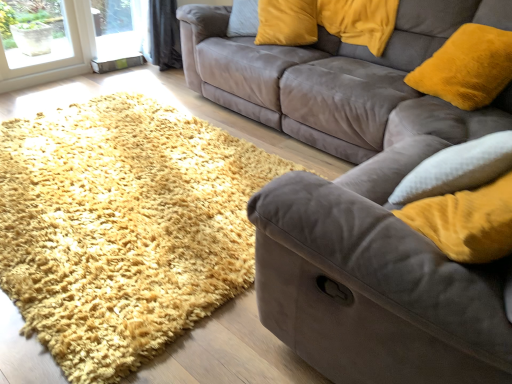
This screenshot has height=384, width=512. Describe the element at coordinates (359, 21) in the screenshot. I see `velvet yellow pillow at upper right, arranged as the 2th pillow when viewed from the left` at that location.

This screenshot has height=384, width=512. In order to click on velvet yellow pillow at upper center, which appears as the second pillow when viewed from the right in this screenshot , I will do `click(287, 22)`.

Describe the element at coordinates (323, 72) in the screenshot. I see `velvet gray couch at center, which appears as the 1th studio couch when viewed from the back` at that location.

The width and height of the screenshot is (512, 384). In order to click on suede couch at center, the second studio couch positioned from the back in this screenshot , I will do `click(361, 199)`.

Is suede couch at center, the 1th studio couch from the front, touching velvet gray couch at center, which ranks as the second studio couch in front-to-back order?

No, suede couch at center, the 1th studio couch from the front, is not in contact with velvet gray couch at center, which ranks as the second studio couch in front-to-back order.

From a real-world perspective, who is located lower, suede couch at center, the second studio couch positioned from the back, or velvet gray couch at center, which ranks as the second studio couch in front-to-back order?

velvet gray couch at center, which ranks as the second studio couch in front-to-back order, is physically lower.

Is point (240, 40) more distant than point (301, 112)?

Yes, point (240, 40) is farther from viewer.

Would you consider velvet yellow pillow at upper center, which appears as the second pillow when viewed from the right, to be distant from velvet yellow pillow at upper right, arranged as the 2th pillow when viewed from the left?

They are positioned close to each other.

Relative to velvet yellow pillow at upper right, which appears as the first pillow when viewed from the right, is velvet yellow pillow at upper center, which is counted as the first pillow, starting from the left, in front or behind?

velvet yellow pillow at upper center, which is counted as the first pillow, starting from the left, is positioned farther from the viewer than velvet yellow pillow at upper right, which appears as the first pillow when viewed from the right.

Is velvet yellow pillow at upper center, which is counted as the first pillow, starting from the left, situated inside velvet yellow pillow at upper right, arranged as the 2th pillow when viewed from the left, or outside?

velvet yellow pillow at upper center, which is counted as the first pillow, starting from the left, cannot be found inside velvet yellow pillow at upper right, arranged as the 2th pillow when viewed from the left.

In terms of width, does velvet yellow pillow at upper center, which is counted as the first pillow, starting from the left, look wider or thinner when compared to velvet yellow pillow at upper right, which appears as the first pillow when viewed from the right?

velvet yellow pillow at upper center, which is counted as the first pillow, starting from the left, is thinner than velvet yellow pillow at upper right, which appears as the first pillow when viewed from the right.

Is suede couch at center, the 1th studio couch from the front, at the right side of velvet yellow pillow at upper right, arranged as the 2th pillow when viewed from the left?

Correct, you'll find suede couch at center, the 1th studio couch from the front, to the right of velvet yellow pillow at upper right, arranged as the 2th pillow when viewed from the left.

From the image's perspective, which is above, suede couch at center, the 1th studio couch from the front, or velvet yellow pillow at upper right, which appears as the first pillow when viewed from the right?

velvet yellow pillow at upper right, which appears as the first pillow when viewed from the right, is shown above in the image.

Based on the photo, is velvet yellow pillow at upper right, arranged as the 2th pillow when viewed from the left, completely or partially inside suede couch at center, the 1th studio couch from the front?

No, velvet yellow pillow at upper right, arranged as the 2th pillow when viewed from the left, is not inside suede couch at center, the 1th studio couch from the front.

This screenshot has width=512, height=384. What are the coordinates of `studio couch to the right of velvet yellow pillow at upper right, which appears as the first pillow when viewed from the right` in the screenshot? It's located at tap(361, 199).

Is point (183, 61) farther from camera compared to point (295, 42)?

Yes, point (183, 61) is farther from viewer.

Identify the location of pillow on the left of velvet gray couch at center, which appears as the 1th studio couch when viewed from the back. point(287,22).

From their relative heights in the image, would you say velvet gray couch at center, which appears as the 1th studio couch when viewed from the back, is taller or shorter than velvet yellow pillow at upper center, which is counted as the first pillow, starting from the left?

Considering their sizes, velvet gray couch at center, which appears as the 1th studio couch when viewed from the back, has more height than velvet yellow pillow at upper center, which is counted as the first pillow, starting from the left.

From the picture: Is shaggy yellow rug at lower left at the back of velvet gray couch at center, which appears as the 1th studio couch when viewed from the back?

No, velvet gray couch at center, which appears as the 1th studio couch when viewed from the back,'s orientation is not away from shaggy yellow rug at lower left.

From the image's perspective, is velvet gray couch at center, which appears as the 1th studio couch when viewed from the back, located above or below shaggy yellow rug at lower left?

velvet gray couch at center, which appears as the 1th studio couch when viewed from the back, is situated higher than shaggy yellow rug at lower left in the image.

How different are the orientations of velvet gray couch at center, which ranks as the second studio couch in front-to-back order, and shaggy yellow rug at lower left in degrees?

They differ by 2.64e-05 degrees in their facing directions.

Measure the distance between velvet gray couch at center, which appears as the 1th studio couch when viewed from the back, and shaggy yellow rug at lower left.

A distance of 33.49 inches exists between velvet gray couch at center, which appears as the 1th studio couch when viewed from the back, and shaggy yellow rug at lower left.

Does point (263, 64) lie in front of point (373, 103)?

No, (263, 64) is behind (373, 103).

Is velvet gray couch at center, which appears as the 1th studio couch when viewed from the back, positioned in front of suede couch at center, the second studio couch positioned from the back?

That is False.

Can you tell me how much velvet yellow pillow at upper center, which is counted as the first pillow, starting from the left, and shaggy yellow rug at lower left differ in facing direction?

There is a 36.6-degree angle between the facing directions of velvet yellow pillow at upper center, which is counted as the first pillow, starting from the left, and shaggy yellow rug at lower left.

Considering the points (311, 42) and (90, 213), which point is behind, point (311, 42) or point (90, 213)?

Point (311, 42)

Is velvet yellow pillow at upper center, which is counted as the first pillow, starting from the left, to the right of shaggy yellow rug at lower left from the viewer's perspective?

Indeed, velvet yellow pillow at upper center, which is counted as the first pillow, starting from the left, is positioned on the right side of shaggy yellow rug at lower left.

Considering the relative sizes of velvet yellow pillow at upper center, which appears as the second pillow when viewed from the right, and shaggy yellow rug at lower left in the image provided, is velvet yellow pillow at upper center, which appears as the second pillow when viewed from the right, thinner than shaggy yellow rug at lower left?

Yes.

Where is `studio couch in front of the velvet gray couch at center, which ranks as the second studio couch in front-to-back order`? Image resolution: width=512 pixels, height=384 pixels. studio couch in front of the velvet gray couch at center, which ranks as the second studio couch in front-to-back order is located at coordinates (361, 199).

Identify the location of pillow behind the velvet yellow pillow at upper right, arranged as the 2th pillow when viewed from the left. (287, 22).

Looking at the image, which one is located closer to shaggy yellow rug at lower left, velvet yellow pillow at upper center, which appears as the second pillow when viewed from the right, or velvet yellow pillow at upper right, which appears as the first pillow when viewed from the right?

velvet yellow pillow at upper center, which appears as the second pillow when viewed from the right.

Looking at this image, from the image, which object appears to be farther from suede couch at center, the second studio couch positioned from the back, velvet yellow pillow at upper center, which appears as the second pillow when viewed from the right, or velvet yellow pillow at upper right, which appears as the first pillow when viewed from the right?

velvet yellow pillow at upper center, which appears as the second pillow when viewed from the right, is further to suede couch at center, the second studio couch positioned from the back.

Which object lies further to the anchor point velvet yellow pillow at upper center, which appears as the second pillow when viewed from the right, shaggy yellow rug at lower left or velvet yellow pillow at upper right, which appears as the first pillow when viewed from the right?

shaggy yellow rug at lower left lies further to velvet yellow pillow at upper center, which appears as the second pillow when viewed from the right, than the other object.

Estimate the real-world distances between objects in this image. Which object is closer to velvet yellow pillow at upper center, which is counted as the first pillow, starting from the left, velvet gray couch at center, which appears as the 1th studio couch when viewed from the back, or suede couch at center, the second studio couch positioned from the back?

velvet gray couch at center, which appears as the 1th studio couch when viewed from the back, is positioned closer to the anchor velvet yellow pillow at upper center, which is counted as the first pillow, starting from the left.

Estimate the real-world distances between objects in this image. Which object is closer to suede couch at center, the second studio couch positioned from the back, velvet gray couch at center, which ranks as the second studio couch in front-to-back order, or velvet yellow pillow at upper right, arranged as the 2th pillow when viewed from the left?

velvet gray couch at center, which ranks as the second studio couch in front-to-back order.

Consider the image. Estimate the real-world distances between objects in this image. Which object is further from velvet yellow pillow at upper right, arranged as the 2th pillow when viewed from the left, velvet yellow pillow at upper center, which is counted as the first pillow, starting from the left, or shaggy yellow rug at lower left?

shaggy yellow rug at lower left lies further to velvet yellow pillow at upper right, arranged as the 2th pillow when viewed from the left, than the other object.

Looking at the image, which one is located closer to velvet yellow pillow at upper center, which appears as the second pillow when viewed from the right, shaggy yellow rug at lower left or velvet gray couch at center, which ranks as the second studio couch in front-to-back order?

The object closer to velvet yellow pillow at upper center, which appears as the second pillow when viewed from the right, is velvet gray couch at center, which ranks as the second studio couch in front-to-back order.

Estimate the real-world distances between objects in this image. Which object is further from velvet yellow pillow at upper right, which appears as the first pillow when viewed from the right, shaggy yellow rug at lower left or suede couch at center, the 1th studio couch from the front?

shaggy yellow rug at lower left.

Where is `mat between suede couch at center, the second studio couch positioned from the back, and velvet yellow pillow at upper right, arranged as the 2th pillow when viewed from the left, along the z-axis`? mat between suede couch at center, the second studio couch positioned from the back, and velvet yellow pillow at upper right, arranged as the 2th pillow when viewed from the left, along the z-axis is located at coordinates (123, 228).

The image size is (512, 384). What are the coordinates of `studio couch between shaggy yellow rug at lower left and velvet yellow pillow at upper center, which is counted as the first pillow, starting from the left, in the front-back direction` in the screenshot? It's located at (323, 72).

Locate an element on the screen. This screenshot has height=384, width=512. mat between suede couch at center, the 1th studio couch from the front, and velvet yellow pillow at upper center, which appears as the second pillow when viewed from the right, in the front-back direction is located at coordinates (123, 228).

Image resolution: width=512 pixels, height=384 pixels. Find the location of `studio couch between suede couch at center, the second studio couch positioned from the back, and velvet yellow pillow at upper right, arranged as the 2th pillow when viewed from the left, from front to back`. studio couch between suede couch at center, the second studio couch positioned from the back, and velvet yellow pillow at upper right, arranged as the 2th pillow when viewed from the left, from front to back is located at coordinates (323, 72).